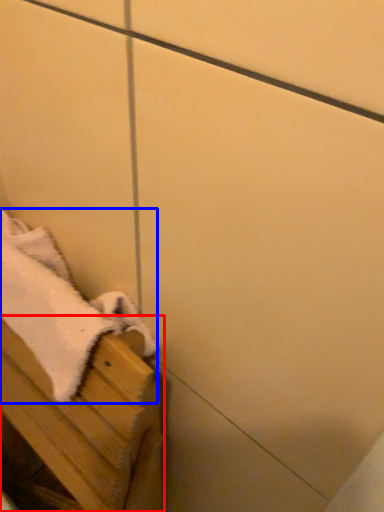
Question: Which point is further to the camera, furniture (highlighted by a red box) or bath towel (highlighted by a blue box)?

Choices:
 (A) furniture
 (B) bath towel

Answer: (B)